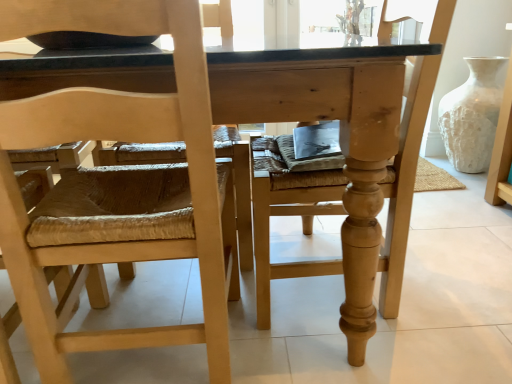
Where is `natural wood chair at center, the 2th chair viewed from the left`? natural wood chair at center, the 2th chair viewed from the left is located at coordinates (290, 215).

What do you see at coordinates (290, 215) in the screenshot? I see `natural wood chair at center, the first chair when ordered from right to left` at bounding box center [290, 215].

The width and height of the screenshot is (512, 384). What do you see at coordinates (314, 89) in the screenshot?
I see `natural wood table at center` at bounding box center [314, 89].

Identify the location of white textured vase at right. (472, 116).

You are a GUI agent. You are given a task and a screenshot of the screen. Output one action in this format:
    pyautogui.click(x=<x>, y=<y>)
    Task: Click on the natural wood chair at center, the first chair when ordered from right to left
    This screenshot has height=384, width=512.
    Given the screenshot: What is the action you would take?
    click(290, 215)

Which object is more forward, natural wood chair at center, the first chair when ordered from right to left, or natural wood table at center?

natural wood table at center is closer to the camera.

Can you confirm if natural wood chair at center, the 2th chair viewed from the left, is taller than natural wood table at center?

Correct, natural wood chair at center, the 2th chair viewed from the left, is much taller as natural wood table at center.

Does point (412, 200) lie behind point (394, 63)?

Yes, it is.

Based on the photo, does white textured vase at right have a lesser height compared to natural wood chair at left, the second chair viewed from the right?

Indeed, white textured vase at right has a lesser height compared to natural wood chair at left, the second chair viewed from the right.

Can natural wood chair at left, the second chair viewed from the right, be found inside white textured vase at right?

No, white textured vase at right does not contain natural wood chair at left, the second chair viewed from the right.

Which of these two, white textured vase at right or natural wood chair at left, the second chair viewed from the right, is smaller?

white textured vase at right.

Does point (167, 129) come closer to viewer compared to point (106, 59)?

Yes.

From the image's perspective, between natural wood chair at left, placed as the first chair when sorted from left to right, and natural wood table at center, which one is located above?

natural wood chair at left, placed as the first chair when sorted from left to right, appears higher in the image.

The image size is (512, 384). In order to click on table below the natural wood chair at left, the second chair viewed from the right (from the image's perspective) in this screenshot , I will do `click(314, 89)`.

How distant is natural wood chair at left, placed as the first chair when sorted from left to right, from natural wood table at center?

They are 11.38 inches apart.

Is white textured vase at right oriented towards natural wood table at center?

No.

How many degrees apart are the facing directions of white textured vase at right and natural wood table at center?

The angle between the facing direction of white textured vase at right and the facing direction of natural wood table at center is 90.1 degrees.

Considering the sizes of objects white textured vase at right and natural wood table at center in the image provided, who is bigger, white textured vase at right or natural wood table at center?

natural wood table at center is bigger.

Do you think natural wood table at center is within white textured vase at right, or outside of it?

natural wood table at center is not inside white textured vase at right, it's outside.

Does point (374, 119) appear closer or farther from the camera than point (475, 157)?

Point (374, 119).

Is natural wood table at center not near white textured vase at right?

Yes, natural wood table at center and white textured vase at right are located far from each other.

Is natural wood chair at left, the second chair viewed from the right, in front of or behind natural wood chair at center, the first chair when ordered from right to left, in the image?

In the image, natural wood chair at left, the second chair viewed from the right, appears in front of natural wood chair at center, the first chair when ordered from right to left.

Which is more to the left, natural wood chair at left, the second chair viewed from the right, or natural wood chair at center, the first chair when ordered from right to left?

From the viewer's perspective, natural wood chair at left, the second chair viewed from the right, appears more on the left side.

In the scene shown: Is natural wood chair at left, placed as the first chair when sorted from left to right, oriented away from natural wood chair at center, the first chair when ordered from right to left?

No, natural wood chair at left, placed as the first chair when sorted from left to right, is not facing the opposite direction of natural wood chair at center, the first chair when ordered from right to left.

Considering the points (114, 22) and (393, 238), which point is in front, point (114, 22) or point (393, 238)?

The point (114, 22) is closer.

Which object is further away from the camera, natural wood table at center or natural wood chair at left, the second chair viewed from the right?

natural wood table at center.

Is natural wood table at center beside natural wood chair at left, the second chair viewed from the right?

No, natural wood table at center is not next to natural wood chair at left, the second chair viewed from the right.

Would you say natural wood table at center is to the left or to the right of natural wood chair at left, placed as the first chair when sorted from left to right, in the picture?

From the image, it's evident that natural wood table at center is to the right of natural wood chair at left, placed as the first chair when sorted from left to right.

Locate an element on the screen. The width and height of the screenshot is (512, 384). chair behind the natural wood table at center is located at coordinates (290, 215).

Image resolution: width=512 pixels, height=384 pixels. I want to click on the 2nd chair in front of the white textured vase at right, so click(127, 183).

Which object lies nearer to the anchor point natural wood table at center, natural wood chair at center, the first chair when ordered from right to left, or natural wood chair at left, the second chair viewed from the right?

The object closer to natural wood table at center is natural wood chair at center, the first chair when ordered from right to left.

When comparing their distances from natural wood chair at center, the 2th chair viewed from the left, does white textured vase at right or natural wood chair at left, placed as the first chair when sorted from left to right, seem further?

white textured vase at right is positioned further to the anchor natural wood chair at center, the 2th chair viewed from the left.

When comparing their distances from natural wood chair at left, the second chair viewed from the right, does white textured vase at right or natural wood table at center seem further?

white textured vase at right.

Looking at the image, which one is located closer to natural wood table at center, white textured vase at right or natural wood chair at center, the first chair when ordered from right to left?

The object closer to natural wood table at center is natural wood chair at center, the first chair when ordered from right to left.

Looking at the image, which one is located further to white textured vase at right, natural wood chair at left, placed as the first chair when sorted from left to right, or natural wood table at center?

natural wood chair at left, placed as the first chair when sorted from left to right, is further to white textured vase at right.

Based on their spatial positions, is natural wood chair at left, the second chair viewed from the right, or natural wood chair at center, the 2th chair viewed from the left, closer to white textured vase at right?

natural wood chair at center, the 2th chair viewed from the left, is positioned closer to the anchor white textured vase at right.

Which object lies nearer to the anchor point white textured vase at right, natural wood table at center or natural wood chair at left, the second chair viewed from the right?

natural wood table at center lies closer to white textured vase at right than the other object.

Which object lies nearer to the anchor point natural wood chair at center, the 2th chair viewed from the left, white textured vase at right or natural wood table at center?

natural wood table at center is closer to natural wood chair at center, the 2th chair viewed from the left.

I want to click on chair between natural wood chair at left, the second chair viewed from the right, and white textured vase at right, along the z-axis, so click(x=290, y=215).

The image size is (512, 384). In order to click on table located between natural wood chair at left, placed as the first chair when sorted from left to right, and white textured vase at right in the depth direction in this screenshot , I will do `click(314, 89)`.

Where is `chair between natural wood table at center and white textured vase at right along the z-axis`? This screenshot has width=512, height=384. chair between natural wood table at center and white textured vase at right along the z-axis is located at coordinates (290, 215).

Locate an element on the screen. chair situated between natural wood chair at left, placed as the first chair when sorted from left to right, and natural wood table at center from left to right is located at coordinates (290, 215).